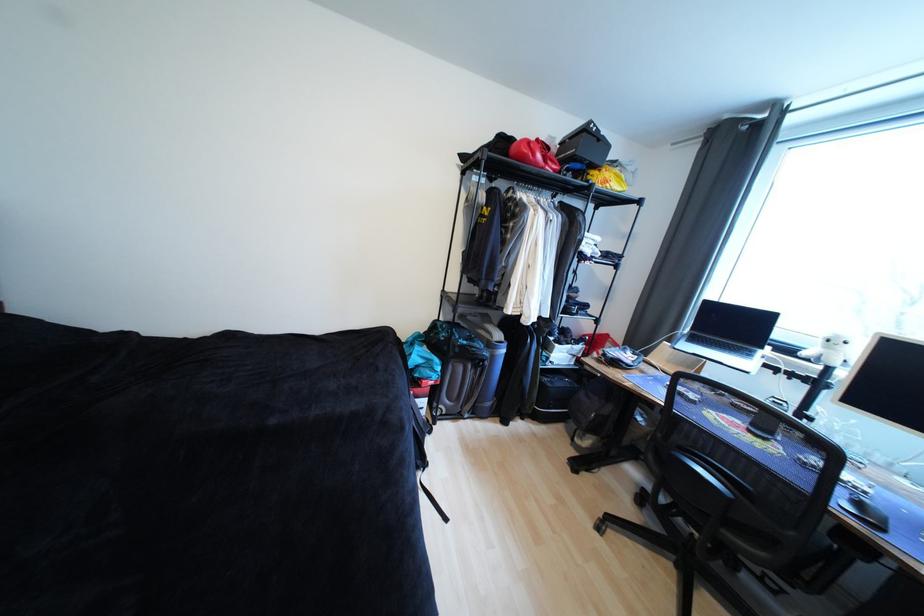
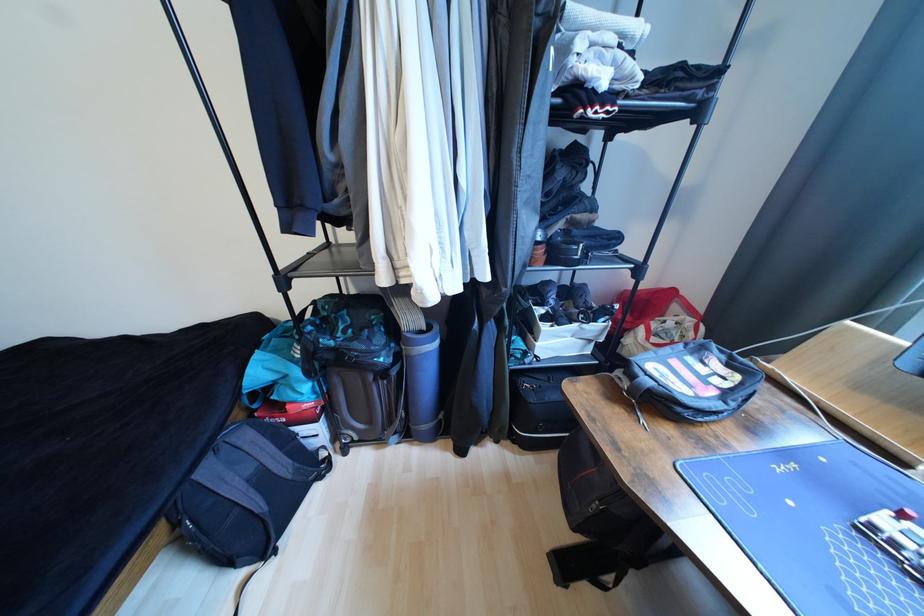
Where in the second image is the point corresponding to pixel 564 347 from the first image?

(552, 329)